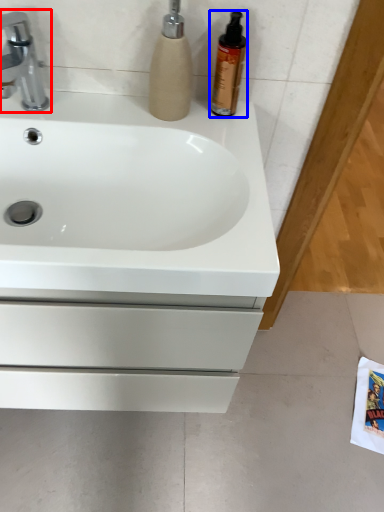
Question: Which object appears closest to the camera in this image, tap (highlighted by a red box) or cleaning product (highlighted by a blue box)?

Choices:
 (A) tap
 (B) cleaning product

Answer: (A)